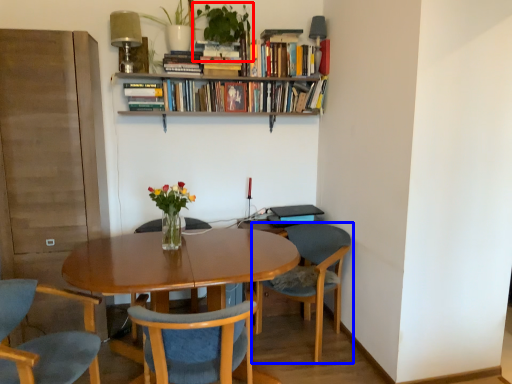
Question: Among these objects, which one is farthest to the camera, houseplant (highlighted by a red box) or chair (highlighted by a blue box)?

Choices:
 (A) houseplant
 (B) chair

Answer: (A)